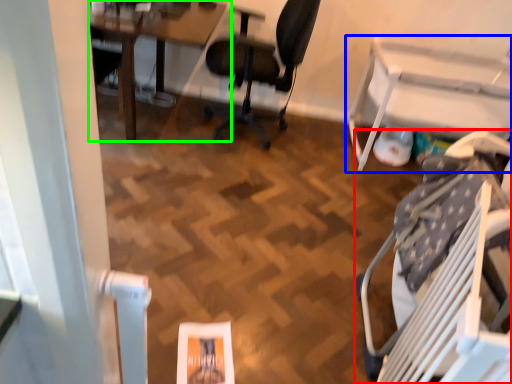
Question: Estimate the real-world distances between objects in this image. Which object is closer to chair (highlighted by a red box), table (highlighted by a blue box) or table (highlighted by a green box)?

Choices:
 (A) table
 (B) table

Answer: (A)